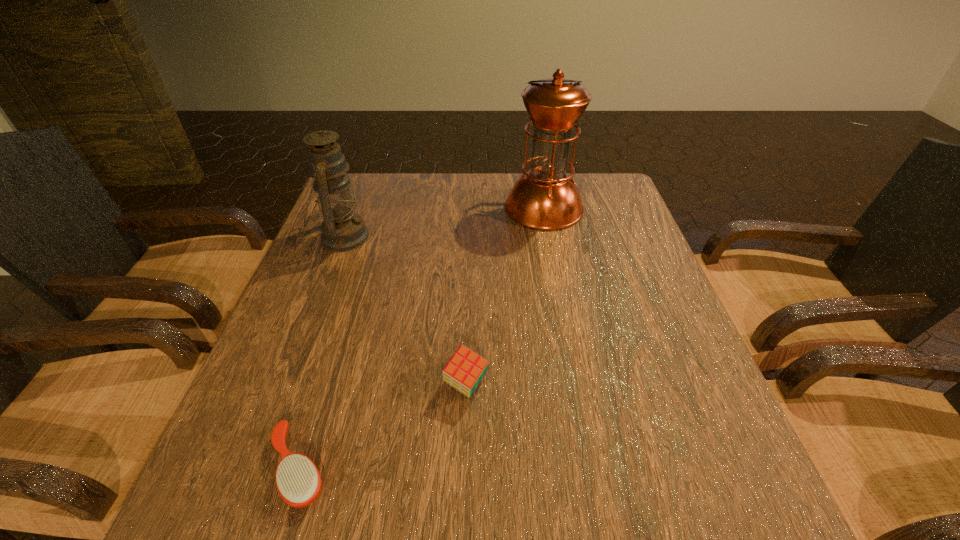
This screenshot has height=540, width=960. In order to click on the right oil lamp in this screenshot , I will do `click(545, 198)`.

You are a GUI agent. You are given a task and a screenshot of the screen. Output one action in this format:
    pyautogui.click(x=<x>, y=<y>)
    Task: Click on the taller oil lamp
    The image size is (960, 540).
    Given the screenshot: What is the action you would take?
    pyautogui.click(x=545, y=198)

Where is `the shorter oil lamp`? The image size is (960, 540). the shorter oil lamp is located at coordinates (342, 230).

I want to click on the left oil lamp, so click(x=342, y=230).

Where is `the third farthest object`? the third farthest object is located at coordinates (465, 370).

The height and width of the screenshot is (540, 960). What are the coordinates of `cube` in the screenshot? It's located at (465, 370).

Where is `the shortest object`? The image size is (960, 540). the shortest object is located at coordinates [x=298, y=481].

Find the location of a particular element. The width and height of the screenshot is (960, 540). the nearest object is located at coordinates (298, 481).

You are a GUI agent. You are given a task and a screenshot of the screen. Output one action in this format:
    pyautogui.click(x=<x>, y=<y>)
    Task: Click on the free space located on the left of the right oil lamp
    The width and height of the screenshot is (960, 540).
    Given the screenshot: What is the action you would take?
    pyautogui.click(x=484, y=208)

Identify the location of vacant space located on the front of the left oil lamp. (303, 340).